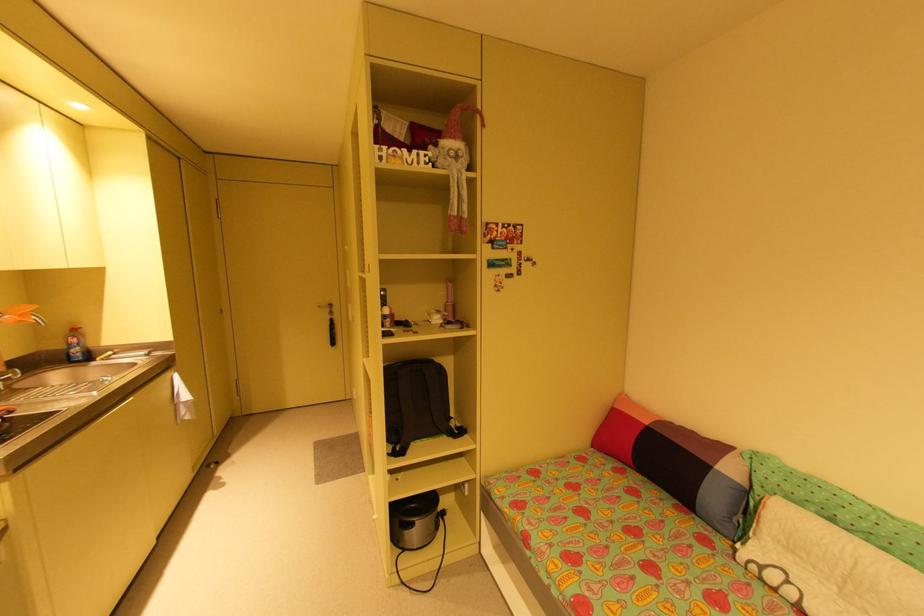
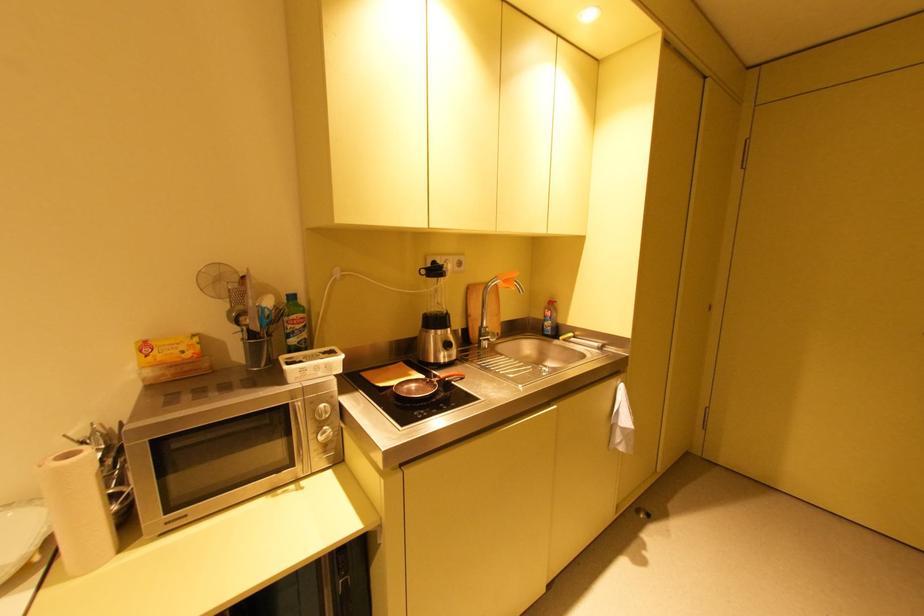
The point at (x=77, y=351) is marked in the first image. Where is the corresponding point in the second image?

(551, 323)